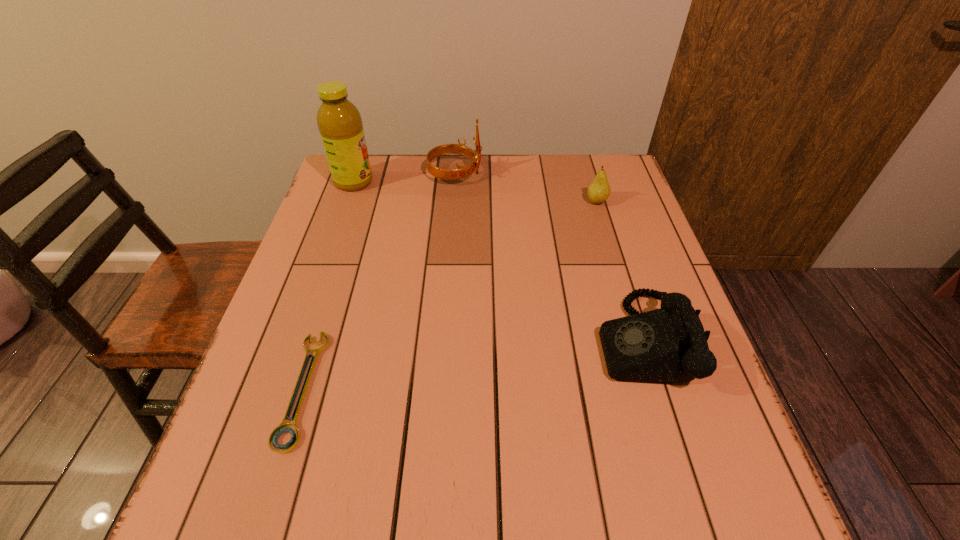
Where is `object that is positioned at the far left corner`? object that is positioned at the far left corner is located at coordinates (339, 122).

Where is `object present at the far right corner`? Image resolution: width=960 pixels, height=540 pixels. object present at the far right corner is located at coordinates (599, 190).

In order to click on free space at the far edge of the desktop in this screenshot , I will do `click(525, 186)`.

Identify the location of vacant area at the left edge. (348, 255).

Identify the location of vacant space at the far left corner of the desktop. (380, 170).

You are a GUI agent. You are given a task and a screenshot of the screen. Output one action in this format:
    pyautogui.click(x=<x>, y=<y>)
    Task: Click on the vacant space at the near left corner of the desktop
    This screenshot has width=960, height=540.
    Given the screenshot: What is the action you would take?
    pyautogui.click(x=307, y=478)

Find the location of a particular element. vacant area at the far right corner of the desktop is located at coordinates (598, 172).

Locate an element on the screen. Image resolution: width=960 pixels, height=540 pixels. blank region between the fruit juice and the telephone is located at coordinates [497, 261].

Identify the location of empty location between the wrench and the tallest object. This screenshot has height=540, width=960. (328, 285).

At what (x,y) coordinates should I click in order to perform the action: click on vacant area that lies between the tiara and the shortest object. Please return your answer as a coordinate pair (x, y). Looking at the image, I should click on (379, 281).